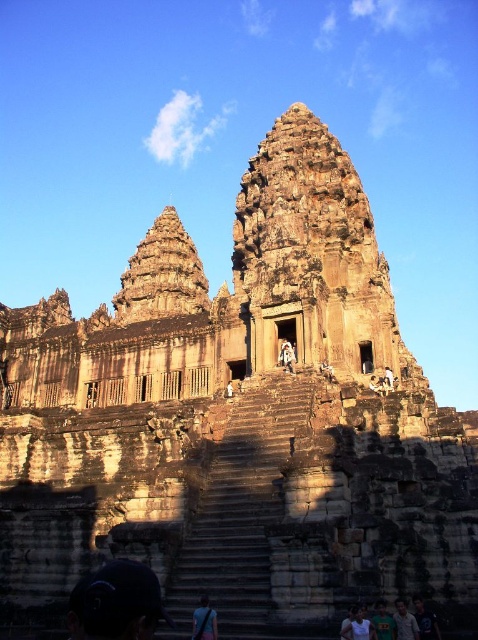
You are a tourist visiting the ancient temple complex and notice a black fabric bag at center. Where exactly is the black fabric bag located in relation to the central staircase?

The black fabric bag at center is located at point coordinates of (204, 620), which places it near the top platform of the central staircase where visitors are sitting and standing.

You are a tourist visiting the ancient temple complex. You see the brown stone stairs at center and the white cotton shirt at lower center. Which object is bigger in size?

The brown stone stairs at center is larger in size than white cotton shirt at lower center.